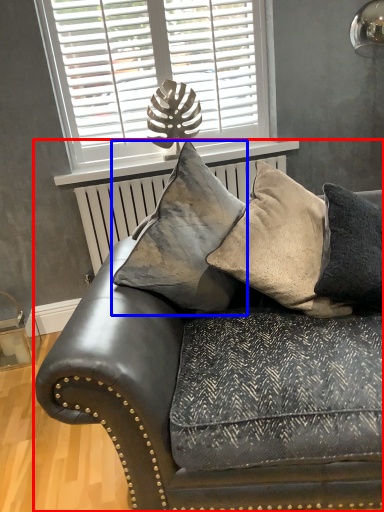
Question: Which point is further to the camera, studio couch (highlighted by a red box) or pillow (highlighted by a blue box)?

Choices:
 (A) studio couch
 (B) pillow

Answer: (B)